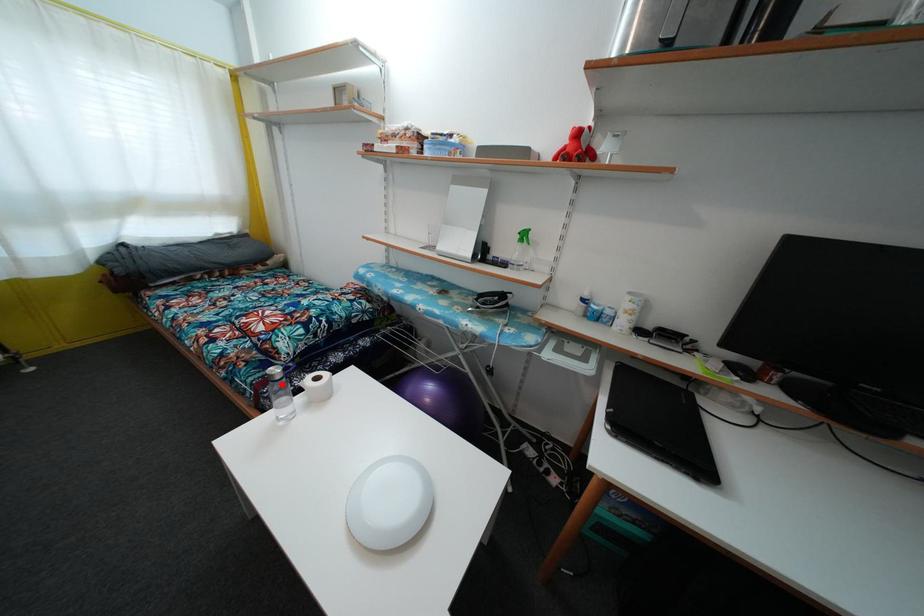
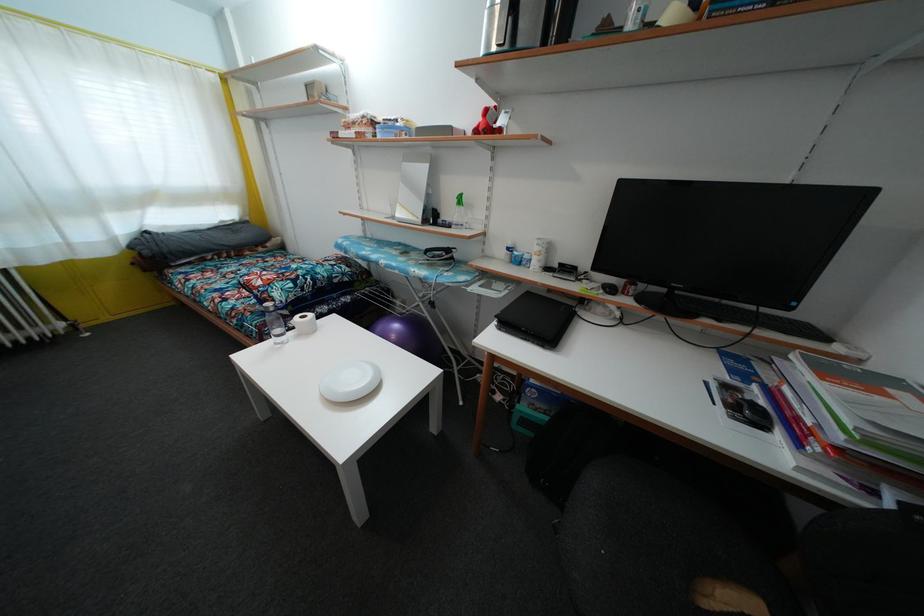
Where in the second image is the point corresponding to the highlighted location from the first image?

(275, 315)